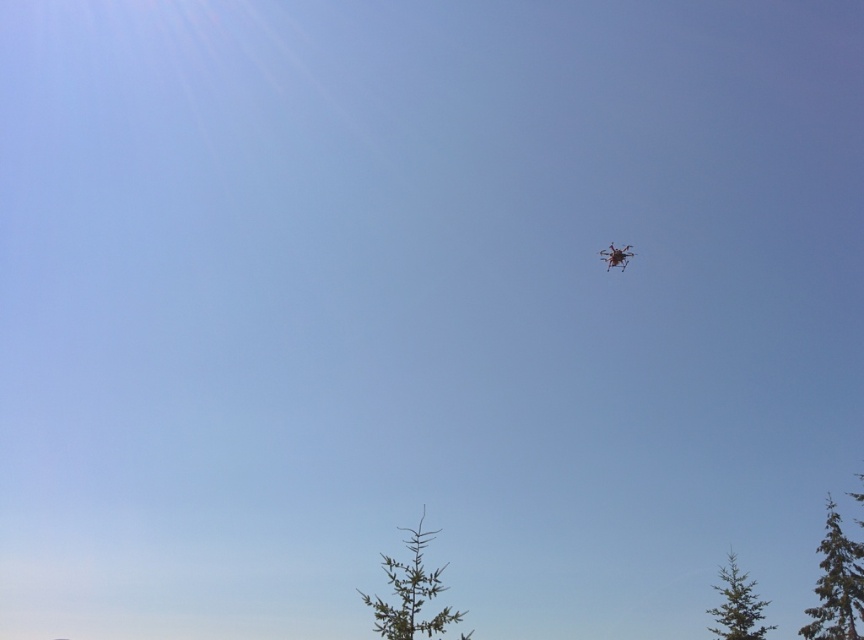
You are standing in the middle of the forest and see the green matte tree at lower center and the metallic silver drone at upper right. Which object is closer to your left side?

The green matte tree at lower center is closer to your left side since it is positioned to the left of the metallic silver drone at upper right.

You are a photographer trying to capture a shot of the metallic silver drone at upper right and the green matte tree at lower right. Which object is positioned farther to the right in the image?

The green matte tree at lower right is positioned farther to the right than the metallic silver drone at upper right.